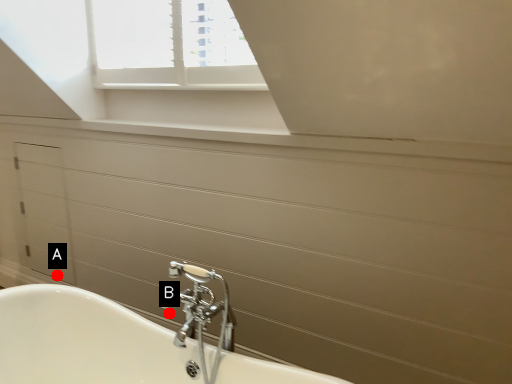
Question: Two points are circled on the image, labeled by A and B beside each circle. Which point is closer to the camera taking this photo?

Choices:
 (A) A is closer
 (B) B is closer

Answer: (B)